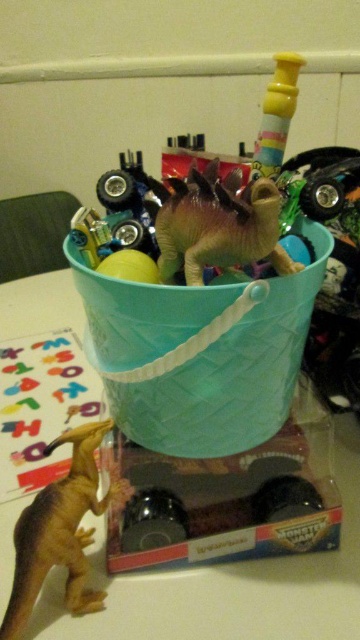
Is point (232, 621) positioned behind point (24, 616)?

Yes, point (232, 621) is behind point (24, 616).

At what (x,y) coordinates should I click in order to perform the action: click on matte plastic table at lower left. Please return your answer as a coordinate pair (x, y). The height and width of the screenshot is (640, 360). Looking at the image, I should click on (243, 589).

Identify the location of matte plastic table at lower left. (243, 589).